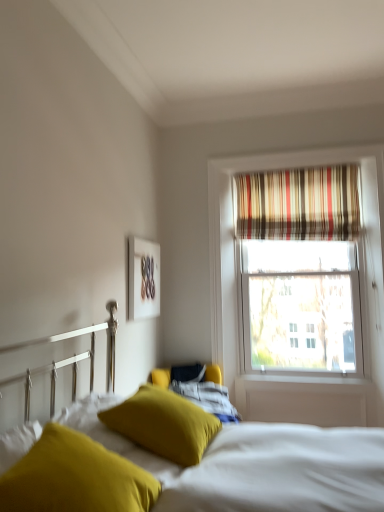
Measure the distance between white matte picture frame at upper center and camera.

They are 2.96 meters apart.

What is the approximate height of white matte picture frame at upper center?

white matte picture frame at upper center is 23.63 inches tall.

What is the approximate width of mustard yellow fabric pillow at center, the first pillow viewed from the back?

mustard yellow fabric pillow at center, the first pillow viewed from the back, is 19.24 inches wide.

Measure the distance between point (236,215) and camera.

A distance of 3.76 meters exists between point (236,215) and camera.

Locate an element on the screen. Image resolution: width=384 pixels, height=512 pixels. striped fabric curtain at upper right is located at coordinates (298, 204).

Where is `white matte picture frame at upper center`? white matte picture frame at upper center is located at coordinates (143, 278).

Is mustard yellow fabric pillow at lower left, acting as the first pillow starting from the front, bigger than striped fabric curtain at upper right?

Incorrect, mustard yellow fabric pillow at lower left, acting as the first pillow starting from the front, is not larger than striped fabric curtain at upper right.

Considering the positions of point (91, 474) and point (237, 181), is point (91, 474) closer or farther from the camera than point (237, 181)?

Point (91, 474) appears to be closer to the viewer than point (237, 181).

Is mustard yellow fabric pillow at lower left, acting as the first pillow starting from the front, in front of or behind striped fabric curtain at upper right in the image?

Clearly, mustard yellow fabric pillow at lower left, acting as the first pillow starting from the front, is in front of striped fabric curtain at upper right.

Choose the correct answer: Is mustard yellow fabric pillow at lower left, placed as the second pillow when sorted from back to front, inside striped fabric curtain at upper right or outside it?

mustard yellow fabric pillow at lower left, placed as the second pillow when sorted from back to front, exists outside the volume of striped fabric curtain at upper right.

Is point (73, 510) closer to viewer compared to point (135, 305)?

Yes, it is in front of point (135, 305).

Can you see mustard yellow fabric pillow at lower left, placed as the second pillow when sorted from back to front, touching white matte picture frame at upper center?

No.

Would you say mustard yellow fabric pillow at lower left, placed as the second pillow when sorted from back to front, contains white matte picture frame at upper center?

No, white matte picture frame at upper center is located outside of mustard yellow fabric pillow at lower left, placed as the second pillow when sorted from back to front.

Is mustard yellow fabric pillow at lower left, placed as the second pillow when sorted from back to front, closer to the viewer compared to white matte picture frame at upper center?

Yes, it is in front of white matte picture frame at upper center.

Is mustard yellow fabric pillow at center, placed as the second pillow when sorted from front to back, far away from white matte picture frame at upper center?

Yes, mustard yellow fabric pillow at center, placed as the second pillow when sorted from front to back, is far from white matte picture frame at upper center.

Considering the relative sizes of mustard yellow fabric pillow at center, placed as the second pillow when sorted from front to back, and white matte picture frame at upper center in the image provided, is mustard yellow fabric pillow at center, placed as the second pillow when sorted from front to back, smaller than white matte picture frame at upper center?

Incorrect, mustard yellow fabric pillow at center, placed as the second pillow when sorted from front to back, is not smaller in size than white matte picture frame at upper center.

Does point (180, 405) lie behind point (129, 297)?

No, (180, 405) is closer to viewer.

Is mustard yellow fabric pillow at center, the first pillow viewed from the back, positioned with its back to white matte picture frame at upper center?

That's not correct — mustard yellow fabric pillow at center, the first pillow viewed from the back, is not looking away from white matte picture frame at upper center.

From a real-world perspective, is mustard yellow fabric pillow at lower left, placed as the second pillow when sorted from back to front, positioned above or below mustard yellow fabric pillow at center, the first pillow viewed from the back?

From a real-world perspective, mustard yellow fabric pillow at lower left, placed as the second pillow when sorted from back to front, is physically above mustard yellow fabric pillow at center, the first pillow viewed from the back.

Which of these two, mustard yellow fabric pillow at lower left, placed as the second pillow when sorted from back to front, or mustard yellow fabric pillow at center, the first pillow viewed from the back, is wider?

mustard yellow fabric pillow at center, the first pillow viewed from the back, is wider.

Based on the photo, can you confirm if mustard yellow fabric pillow at lower left, placed as the second pillow when sorted from back to front, is smaller than mustard yellow fabric pillow at center, placed as the second pillow when sorted from front to back?

Yes, mustard yellow fabric pillow at lower left, placed as the second pillow when sorted from back to front, is smaller than mustard yellow fabric pillow at center, placed as the second pillow when sorted from front to back.

Would you say mustard yellow fabric pillow at lower left, placed as the second pillow when sorted from back to front, is outside mustard yellow fabric pillow at center, the first pillow viewed from the back?

mustard yellow fabric pillow at lower left, placed as the second pillow when sorted from back to front, is positioned outside mustard yellow fabric pillow at center, the first pillow viewed from the back.

Is mustard yellow fabric pillow at center, the first pillow viewed from the back, in contact with soft yellow pillow at lower left?

No, mustard yellow fabric pillow at center, the first pillow viewed from the back, is not making contact with soft yellow pillow at lower left.

Could soft yellow pillow at lower left be considered to be inside mustard yellow fabric pillow at center, placed as the second pillow when sorted from front to back?

That's incorrect, soft yellow pillow at lower left is not inside mustard yellow fabric pillow at center, placed as the second pillow when sorted from front to back.

Based on the photo, is mustard yellow fabric pillow at center, placed as the second pillow when sorted from front to back, oriented away from soft yellow pillow at lower left?

Yes, mustard yellow fabric pillow at center, placed as the second pillow when sorted from front to back, is positioned with its back facing soft yellow pillow at lower left.

How much distance is there between mustard yellow fabric pillow at center, the first pillow viewed from the back, and soft yellow pillow at lower left?

mustard yellow fabric pillow at center, the first pillow viewed from the back, and soft yellow pillow at lower left are 8.55 inches apart.

Is white matte picture frame at upper center completely or partially outside of soft yellow pillow at lower left?

Yes.

Considering the relative sizes of white matte picture frame at upper center and soft yellow pillow at lower left in the image provided, is white matte picture frame at upper center wider than soft yellow pillow at lower left?

In fact, white matte picture frame at upper center might be narrower than soft yellow pillow at lower left.

Which is behind, white matte picture frame at upper center or soft yellow pillow at lower left?

white matte picture frame at upper center is further from the camera.

In the image, is white matte picture frame at upper center on the left side or the right side of soft yellow pillow at lower left?

From the image, it's evident that white matte picture frame at upper center is to the left of soft yellow pillow at lower left.

Based on the photo, is white matte picture frame at upper center to the left of mustard yellow fabric pillow at center, placed as the second pillow when sorted from front to back, from the viewer's perspective?

Yes, white matte picture frame at upper center is to the left of mustard yellow fabric pillow at center, placed as the second pillow when sorted from front to back.

Is white matte picture frame at upper center bigger than mustard yellow fabric pillow at center, placed as the second pillow when sorted from front to back?

Incorrect, white matte picture frame at upper center is not larger than mustard yellow fabric pillow at center, placed as the second pillow when sorted from front to back.

Considering the sizes of white matte picture frame at upper center and mustard yellow fabric pillow at center, placed as the second pillow when sorted from front to back, in the image, is white matte picture frame at upper center taller or shorter than mustard yellow fabric pillow at center, placed as the second pillow when sorted from front to back,?

Clearly, white matte picture frame at upper center is taller compared to mustard yellow fabric pillow at center, placed as the second pillow when sorted from front to back.

From a real-world perspective, which is physically above, white matte picture frame at upper center or mustard yellow fabric pillow at center, the first pillow viewed from the back?

white matte picture frame at upper center.

There is a striped fabric curtain at upper right. Where is `the 1st pillow below it (from the image's perspective)`? The width and height of the screenshot is (384, 512). the 1st pillow below it (from the image's perspective) is located at coordinates (75, 478).

Where is `pillow that is the 2nd object located in front of the white matte picture frame at upper center`? The image size is (384, 512). pillow that is the 2nd object located in front of the white matte picture frame at upper center is located at coordinates point(75,478).

Estimate the real-world distances between objects in this image. Which object is closer to white matte picture frame at upper center, soft yellow pillow at lower left or striped fabric curtain at upper right?

striped fabric curtain at upper right.

From the image, which object appears to be nearer to mustard yellow fabric pillow at center, placed as the second pillow when sorted from front to back, mustard yellow fabric pillow at lower left, placed as the second pillow when sorted from back to front, or striped fabric curtain at upper right?

mustard yellow fabric pillow at lower left, placed as the second pillow when sorted from back to front, lies closer to mustard yellow fabric pillow at center, placed as the second pillow when sorted from front to back, than the other object.

Considering their positions, is striped fabric curtain at upper right positioned closer to mustard yellow fabric pillow at lower left, acting as the first pillow starting from the front, than white matte picture frame at upper center?

white matte picture frame at upper center lies closer to mustard yellow fabric pillow at lower left, acting as the first pillow starting from the front, than the other object.

From the image, which object appears to be nearer to mustard yellow fabric pillow at center, the first pillow viewed from the back, striped fabric curtain at upper right or soft yellow pillow at lower left?

soft yellow pillow at lower left lies closer to mustard yellow fabric pillow at center, the first pillow viewed from the back, than the other object.

Considering their positions, is mustard yellow fabric pillow at center, the first pillow viewed from the back, positioned further to striped fabric curtain at upper right than soft yellow pillow at lower left?

soft yellow pillow at lower left is further to striped fabric curtain at upper right.

Based on their spatial positions, is soft yellow pillow at lower left or white matte picture frame at upper center closer to striped fabric curtain at upper right?

white matte picture frame at upper center is positioned closer to the anchor striped fabric curtain at upper right.

Looking at the image, which one is located further to mustard yellow fabric pillow at lower left, acting as the first pillow starting from the front, soft yellow pillow at lower left or striped fabric curtain at upper right?

Based on the image, striped fabric curtain at upper right appears to be further to mustard yellow fabric pillow at lower left, acting as the first pillow starting from the front.

When comparing their distances from mustard yellow fabric pillow at center, placed as the second pillow when sorted from front to back, does white matte picture frame at upper center or mustard yellow fabric pillow at lower left, placed as the second pillow when sorted from back to front, seem closer?

The object closer to mustard yellow fabric pillow at center, placed as the second pillow when sorted from front to back, is mustard yellow fabric pillow at lower left, placed as the second pillow when sorted from back to front.

I want to click on picture frame located between mustard yellow fabric pillow at center, the first pillow viewed from the back, and striped fabric curtain at upper right in the depth direction, so [x=143, y=278].

At what (x,y) coordinates should I click in order to perform the action: click on picture frame between soft yellow pillow at lower left and striped fabric curtain at upper right from front to back. Please return your answer as a coordinate pair (x, y). The width and height of the screenshot is (384, 512). Looking at the image, I should click on (143, 278).

Locate an element on the screen. The image size is (384, 512). pillow located between mustard yellow fabric pillow at lower left, placed as the second pillow when sorted from back to front, and white matte picture frame at upper center in the depth direction is located at coordinates (164, 424).

Locate an element on the screen. This screenshot has width=384, height=512. pillow between mustard yellow fabric pillow at lower left, acting as the first pillow starting from the front, and striped fabric curtain at upper right from front to back is located at coordinates (164, 424).